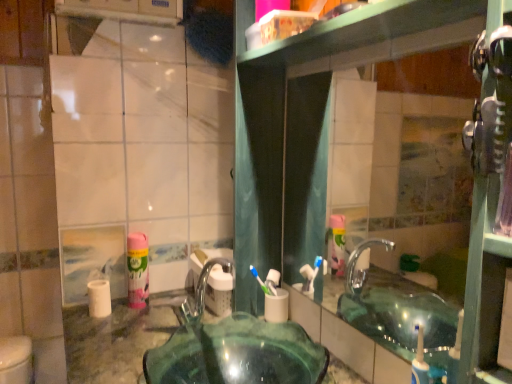
Question: In terms of width, does pink matte mouthwash at left look wider or thinner when compared to transparent glass sink at center?

Choices:
 (A) wide
 (B) thin

Answer: (B)

Question: Relative to transparent glass sink at center, is pink matte mouthwash at left in front or behind?

Choices:
 (A) behind
 (B) front

Answer: (A)

Question: Estimate the real-world distances between objects in this image. Which object is farther from the white matte toilet paper at left, which ranks as the 1th toilet paper in left-to-right order?

Choices:
 (A) pink matte mouthwash at left
 (B) white matte toilet paper at center, placed as the first toilet paper when sorted from right to left
 (C) clear glass mirror at upper center
 (D) transparent glass sink at center

Answer: (C)

Question: Which is nearer to the clear glass mirror at upper center?

Choices:
 (A) transparent glass sink at center
 (B) white matte toilet paper at center, placed as the first toilet paper when sorted from right to left
 (C) white matte toilet paper at left, which is the second toilet paper from right to left
 (D) pink matte mouthwash at left

Answer: (A)